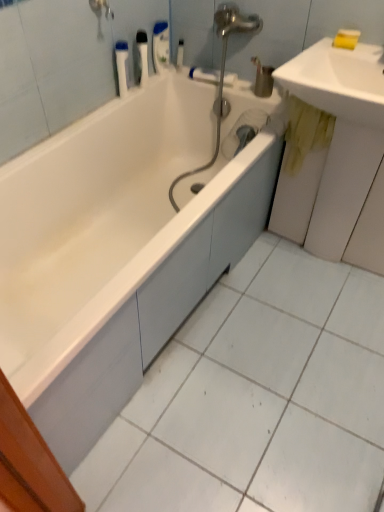
Locate an element on the screen. This screenshot has height=512, width=384. free space in front of white plastic bottle at upper center, acting as the second toiletry starting from the right is located at coordinates (163, 78).